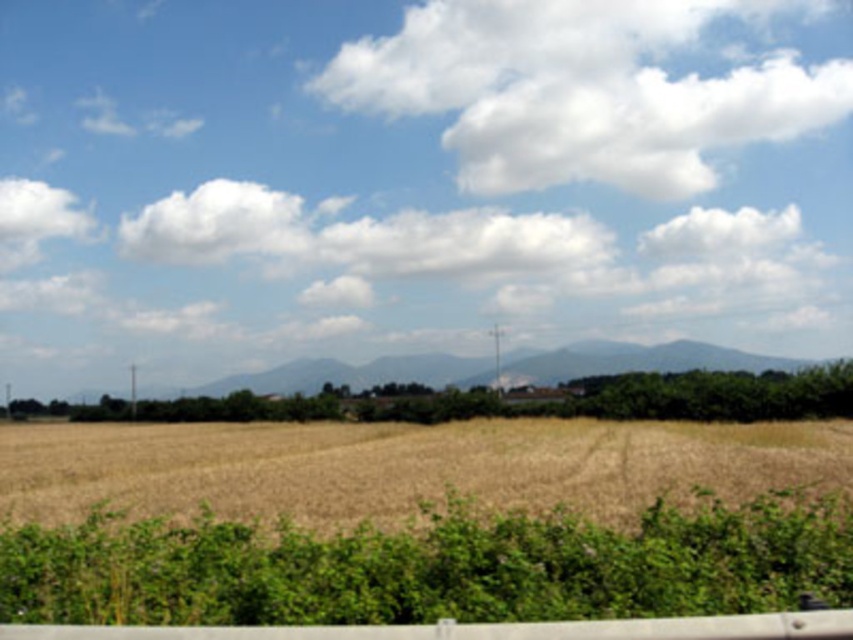
Question: Does golden dry wheat field at center appear under white fluffy cloud at upper center?

Choices:
 (A) no
 (B) yes

Answer: (B)

Question: Does golden dry wheat field at center have a smaller size compared to white fluffy cloud at upper center?

Choices:
 (A) no
 (B) yes

Answer: (A)

Question: Can you confirm if golden dry wheat field at center is bigger than white fluffy cloud at upper center?

Choices:
 (A) no
 (B) yes

Answer: (B)